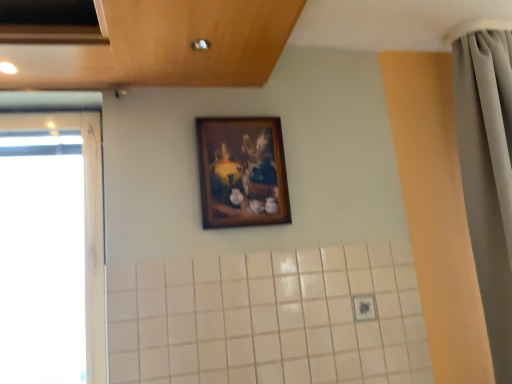
Question: Is wooden frame at upper center at the back of transparent glass window at left?

Choices:
 (A) yes
 (B) no

Answer: (B)

Question: From a real-world perspective, is transparent glass window at left located higher than wooden frame at upper center?

Choices:
 (A) yes
 (B) no

Answer: (B)

Question: From a real-world perspective, is transparent glass window at left located beneath wooden frame at upper center?

Choices:
 (A) no
 (B) yes

Answer: (B)

Question: Considering the relative sizes of transparent glass window at left and wooden frame at upper center in the image provided, is transparent glass window at left wider than wooden frame at upper center?

Choices:
 (A) no
 (B) yes

Answer: (B)

Question: From the image's perspective, does transparent glass window at left appear lower than wooden frame at upper center?

Choices:
 (A) no
 (B) yes

Answer: (B)

Question: In terms of height, does wooden frame at upper center look taller or shorter compared to transparent glass window at left?

Choices:
 (A) tall
 (B) short

Answer: (B)

Question: From the image's perspective, is wooden frame at upper center positioned above or below transparent glass window at left?

Choices:
 (A) below
 (B) above

Answer: (B)

Question: Based on their sizes in the image, would you say wooden frame at upper center is bigger or smaller than transparent glass window at left?

Choices:
 (A) big
 (B) small

Answer: (B)

Question: From a real-world perspective, is wooden frame at upper center positioned above or below transparent glass window at left?

Choices:
 (A) below
 (B) above

Answer: (B)

Question: In the image, is gray fabric shower curtain at right on the left side or the right side of wooden frame at upper center?

Choices:
 (A) left
 (B) right

Answer: (B)

Question: Is point (481, 208) closer or farther from the camera than point (206, 140)?

Choices:
 (A) closer
 (B) farther

Answer: (B)

Question: Is gray fabric shower curtain at right bigger or smaller than wooden frame at upper center?

Choices:
 (A) big
 (B) small

Answer: (A)

Question: Considering the positions of gray fabric shower curtain at right and wooden frame at upper center in the image, is gray fabric shower curtain at right wider or thinner than wooden frame at upper center?

Choices:
 (A) wide
 (B) thin

Answer: (A)

Question: Considering the positions of transparent glass window at left and gray fabric shower curtain at right in the image, is transparent glass window at left bigger or smaller than gray fabric shower curtain at right?

Choices:
 (A) small
 (B) big

Answer: (A)

Question: In terms of height, does transparent glass window at left look taller or shorter compared to gray fabric shower curtain at right?

Choices:
 (A) short
 (B) tall

Answer: (A)